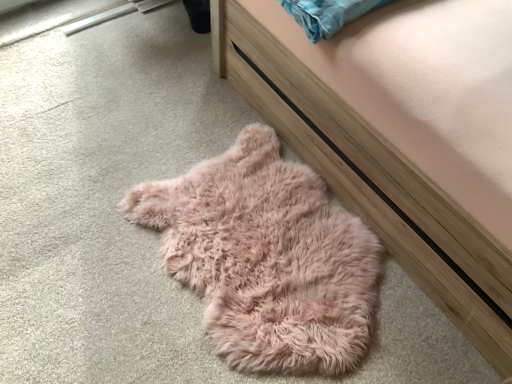
Question: Is fuzzy pink rug at lower left wider than fuzzy pink rug at lower left?

Choices:
 (A) no
 (B) yes

Answer: (A)

Question: Would you say fuzzy pink rug at lower left is outside fuzzy pink rug at lower left?

Choices:
 (A) yes
 (B) no

Answer: (A)

Question: Is fuzzy pink rug at lower left oriented away from fuzzy pink rug at lower left?

Choices:
 (A) no
 (B) yes

Answer: (A)

Question: Are fuzzy pink rug at lower left and fuzzy pink rug at lower left making contact?

Choices:
 (A) yes
 (B) no

Answer: (B)

Question: Is fuzzy pink rug at lower left at the right side of fuzzy pink rug at lower left?

Choices:
 (A) no
 (B) yes

Answer: (A)

Question: Can you confirm if fuzzy pink rug at lower left is shorter than fuzzy pink rug at lower left?

Choices:
 (A) yes
 (B) no

Answer: (A)

Question: Can you confirm if fuzzy pink rug at lower left is thinner than fuzzy pink rug at lower left?

Choices:
 (A) yes
 (B) no

Answer: (B)

Question: Is fuzzy pink rug at lower left with fuzzy pink rug at lower left?

Choices:
 (A) yes
 (B) no

Answer: (B)

Question: Considering the relative sizes of fuzzy pink rug at lower left and fuzzy pink rug at lower left in the image provided, is fuzzy pink rug at lower left wider than fuzzy pink rug at lower left?

Choices:
 (A) yes
 (B) no

Answer: (A)

Question: From the image's perspective, is fuzzy pink rug at lower left over fuzzy pink rug at lower left?

Choices:
 (A) yes
 (B) no

Answer: (A)

Question: Is fuzzy pink rug at lower left positioned beyond the bounds of fuzzy pink rug at lower left?

Choices:
 (A) no
 (B) yes

Answer: (B)

Question: Considering the relative sizes of fuzzy pink rug at lower left and fuzzy pink rug at lower left in the image provided, is fuzzy pink rug at lower left taller than fuzzy pink rug at lower left?

Choices:
 (A) no
 (B) yes

Answer: (B)

Question: Does point (370, 173) appear closer or farther from the camera than point (189, 269)?

Choices:
 (A) closer
 (B) farther

Answer: (A)